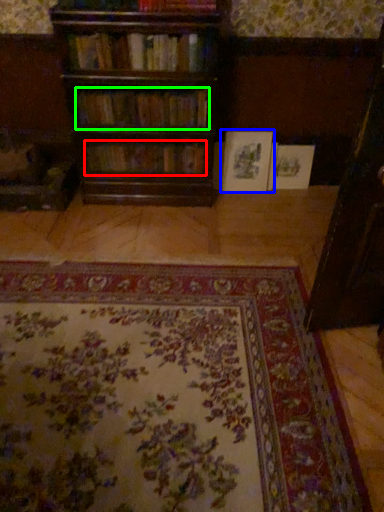
Question: Based on their relative distances, which object is nearer to book (highlighted by a red box)? Choose from book (highlighted by a blue box) and book (highlighted by a green box).

Choices:
 (A) book
 (B) book

Answer: (B)